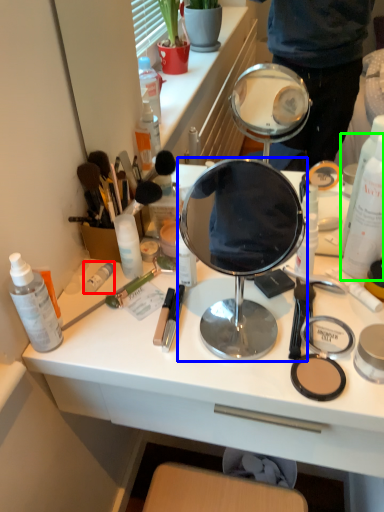
Question: Considering the real-world distances, which object is farthest from toiletry (highlighted by a red box)? mirror (highlighted by a blue box) or bottle (highlighted by a green box)?

Choices:
 (A) mirror
 (B) bottle

Answer: (A)